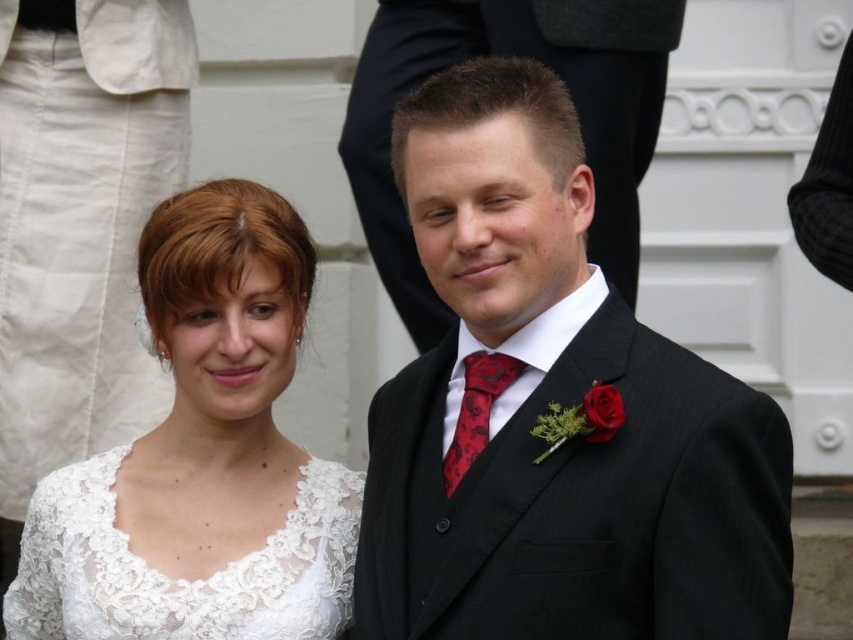
Does point (155, 442) come closer to viewer compared to point (352, 541)?

No, (155, 442) is behind (352, 541).

Can you confirm if white lace dress at center is positioned to the right of lace fabric dress at lower left?

Yes, white lace dress at center is to the right of lace fabric dress at lower left.

The image size is (853, 640). What do you see at coordinates (202, 458) in the screenshot? I see `white lace dress at center` at bounding box center [202, 458].

Identify the location of white lace dress at center. The image size is (853, 640). (202, 458).

Does lace fabric dress at lower left appear on the left side of red satin tie at center?

Correct, you'll find lace fabric dress at lower left to the left of red satin tie at center.

This screenshot has height=640, width=853. What are the coordinates of `lace fabric dress at lower left` in the screenshot? It's located at tap(180, 579).

The height and width of the screenshot is (640, 853). What are the coordinates of `lace fabric dress at lower left` in the screenshot? It's located at (180, 579).

Can you confirm if black pinstripe suit at center is smaller than red satin tie at center?

Incorrect, black pinstripe suit at center is not smaller in size than red satin tie at center.

Between black pinstripe suit at center and red satin tie at center, which one is positioned lower?

red satin tie at center

This screenshot has width=853, height=640. What do you see at coordinates (548, 406) in the screenshot? I see `black pinstripe suit at center` at bounding box center [548, 406].

Identify the location of black pinstripe suit at center. (548, 406).